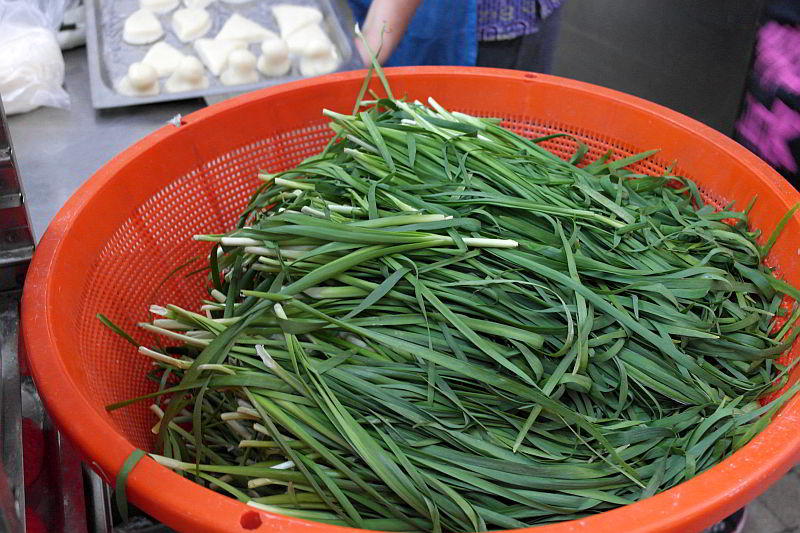
You are a GUI agent. You are given a task and a screenshot of the screen. Output one action in this format:
    pyautogui.click(x=<x>, y=<y>)
    Task: Click on the tray
    The image size is (800, 533).
    Given the screenshot: What is the action you would take?
    pyautogui.click(x=110, y=49), pyautogui.click(x=212, y=77), pyautogui.click(x=160, y=85), pyautogui.click(x=254, y=46), pyautogui.click(x=292, y=67), pyautogui.click(x=344, y=43), pyautogui.click(x=220, y=10), pyautogui.click(x=166, y=21)